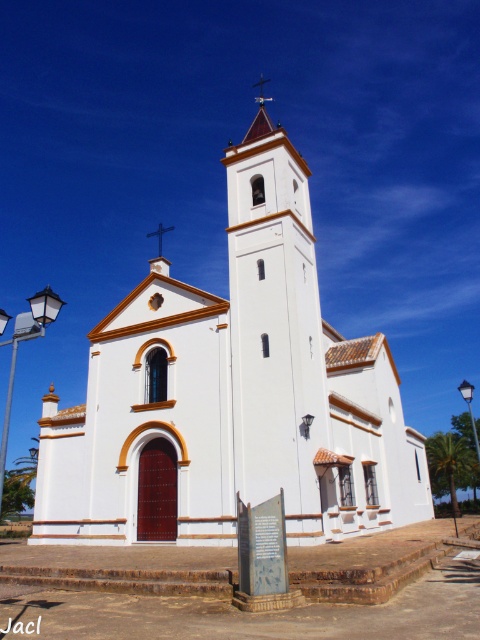
You are standing in front of the church and want to take a photo of the white smooth tower at center. If your camera can focus on objects up to 100 feet away, will it be able to capture the tower clearly?

The white smooth tower at center is 87.23 feet away from the viewer. Since the camera can focus up to 100 feet, it will be able to capture the tower clearly.

You are standing in front of the white matte church at center and want to walk to the matte black lamppost at left. Which direction should you move relative to the church?

The white matte church at center is positioned over the matte black lamppost at left, so you should move to the left and downward direction relative to the church to reach the lamppost.

You are standing in front of a white church with Spanish architecture. The church has a tall bell tower on its right side. Where is the white matte church at center located in terms of coordinates?

The white matte church at center is located at coordinates point (231, 394).